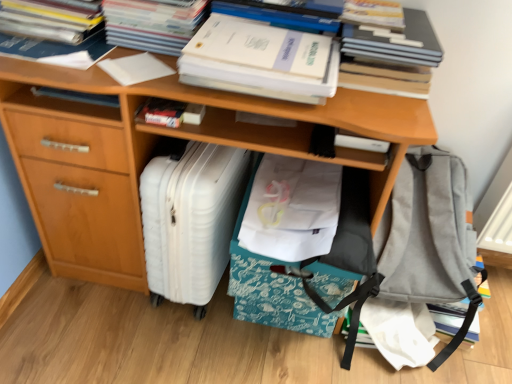
What are the coordinates of `vacant space situated above white matte paper at upper center, the 3th paperback book viewed from the left (from a real-world perspective)` in the screenshot? It's located at (267, 42).